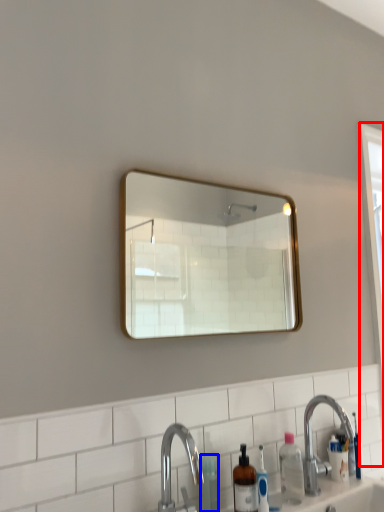
Question: Which object is closer to the camera taking this photo, screen door (highlighted by a red box) or toiletry (highlighted by a blue box)?

Choices:
 (A) screen door
 (B) toiletry

Answer: (B)